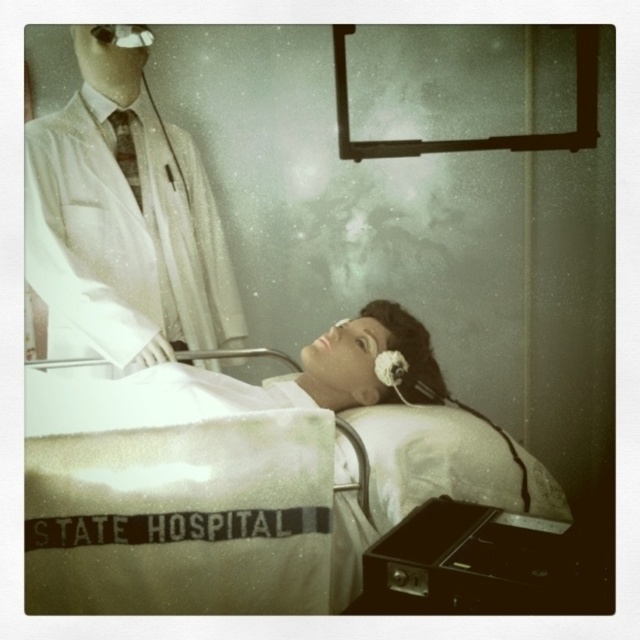
Question: From the image, what is the correct spatial relationship of white matte lab coat at upper left in relation to white cotton hospital bed at center?

Choices:
 (A) above
 (B) below

Answer: (A)

Question: Considering the relative positions of white matte lab coat at upper left and white cotton hospital bed at center in the image provided, where is white matte lab coat at upper left located with respect to white cotton hospital bed at center?

Choices:
 (A) right
 (B) left

Answer: (B)

Question: Does white matte lab coat at upper left lie behind white cotton hospital bed at center?

Choices:
 (A) yes
 (B) no

Answer: (A)

Question: Which of the following is the farthest from the observer?

Choices:
 (A) white cotton hospital bed at center
 (B) white matte lab coat at upper left

Answer: (B)

Question: Which point is farther to the camera?

Choices:
 (A) (29, 170)
 (B) (346, 320)

Answer: (B)